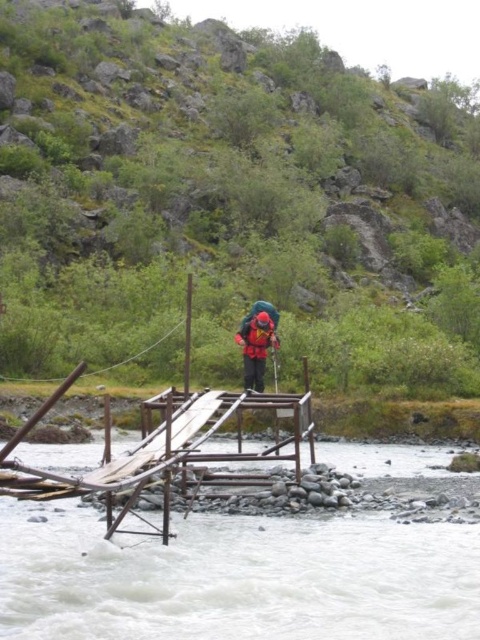
Does white frothy water at center have a larger size compared to red fabric helmet at center?

Correct, white frothy water at center is larger in size than red fabric helmet at center.

Between white frothy water at center and red fabric helmet at center, which one is positioned lower?

white frothy water at center is lower down.

Does point (325, 531) lie behind point (248, 317)?

No, (325, 531) is closer to viewer.

I want to click on white frothy water at center, so click(236, 577).

Can you confirm if green grassy hillside at upper center is positioned to the left of red fabric helmet at center?

Correct, you'll find green grassy hillside at upper center to the left of red fabric helmet at center.

Is point (129, 36) farther from viewer compared to point (250, 369)?

Yes.

Locate an element on the screen. This screenshot has height=640, width=480. green grassy hillside at upper center is located at coordinates tap(230, 198).

Can you confirm if green grassy hillside at upper center is positioned above white frothy water at center?

Indeed, green grassy hillside at upper center is positioned over white frothy water at center.

Is point (290, 189) positioned behind point (156, 577)?

Yes, it is behind point (156, 577).

I want to click on green grassy hillside at upper center, so 230,198.